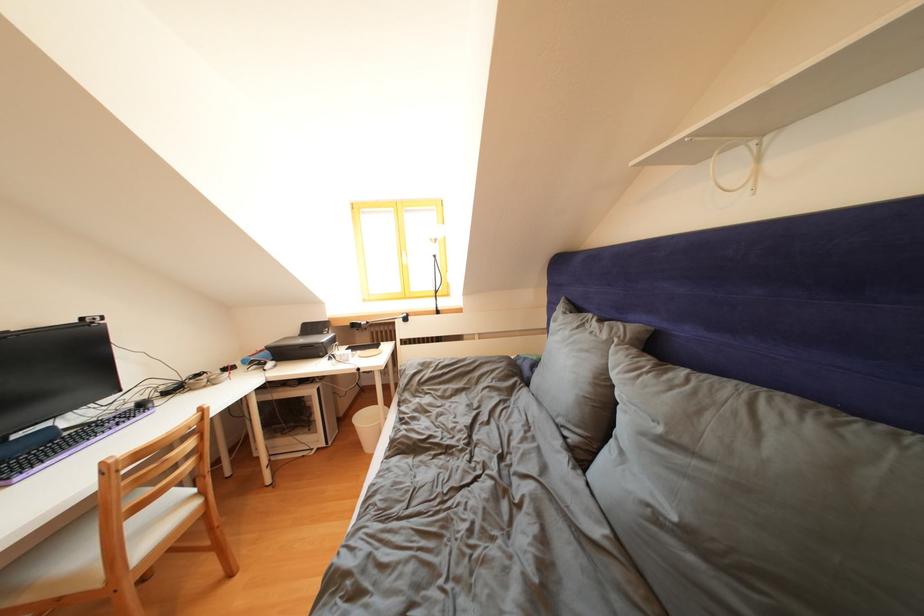
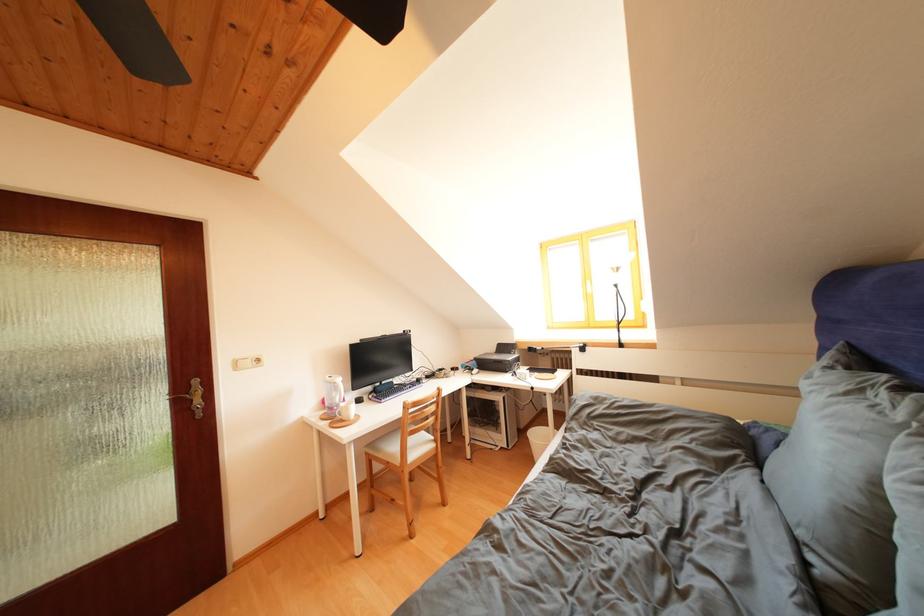
Find the pixel in the second image that matches [142,528] in the first image.

(419, 446)